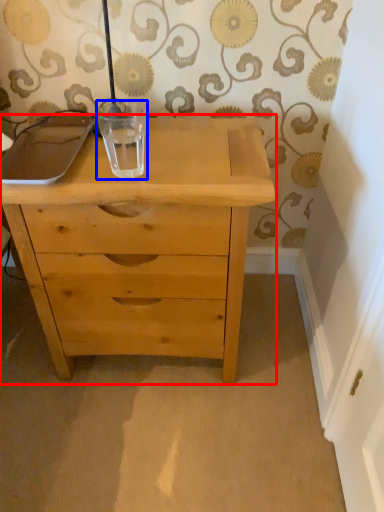
Question: Which object is closer to the camera taking this photo, chest of drawers (highlighted by a red box) or glass vase (highlighted by a blue box)?

Choices:
 (A) chest of drawers
 (B) glass vase

Answer: (A)